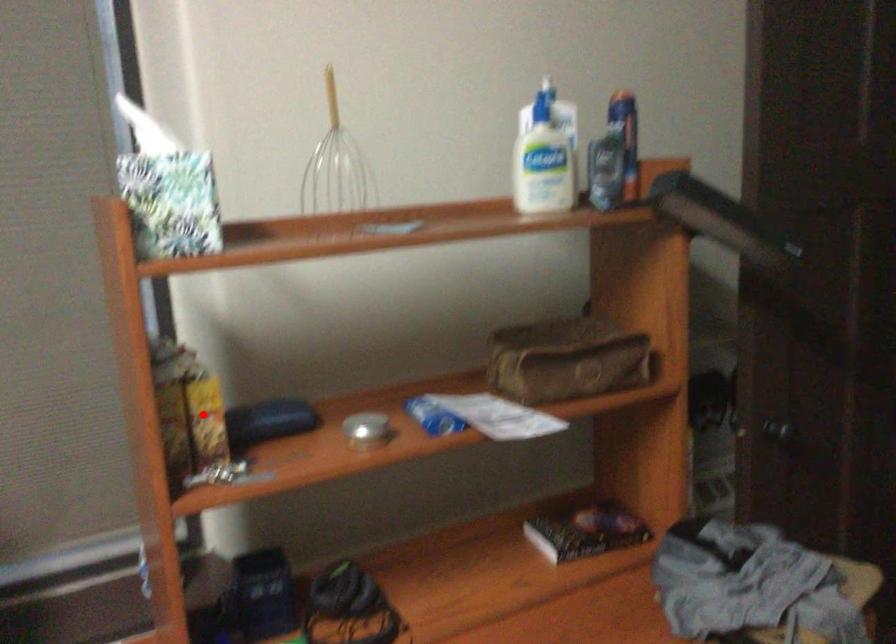
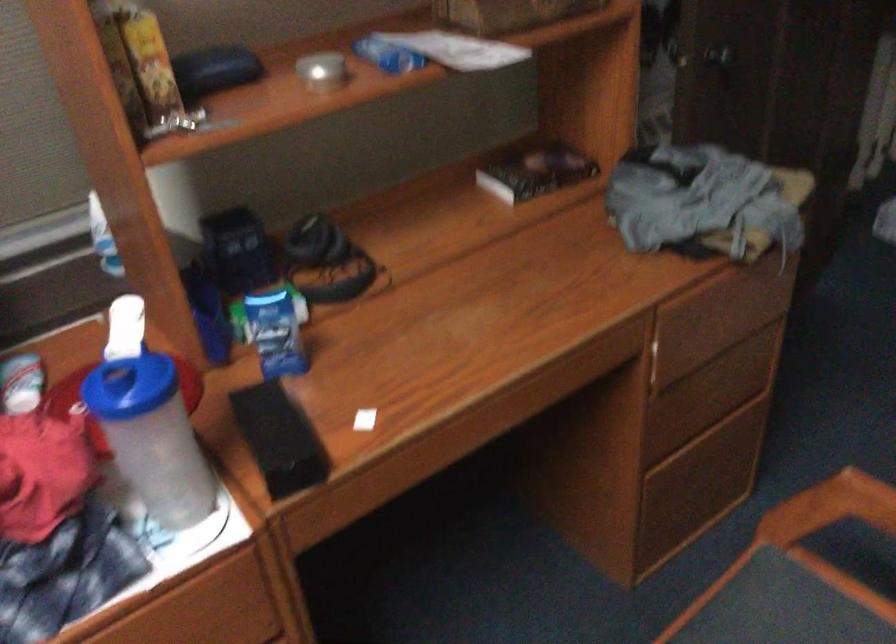
In the second image, find the point that corresponds to the highlighted location in the first image.

(149, 61)